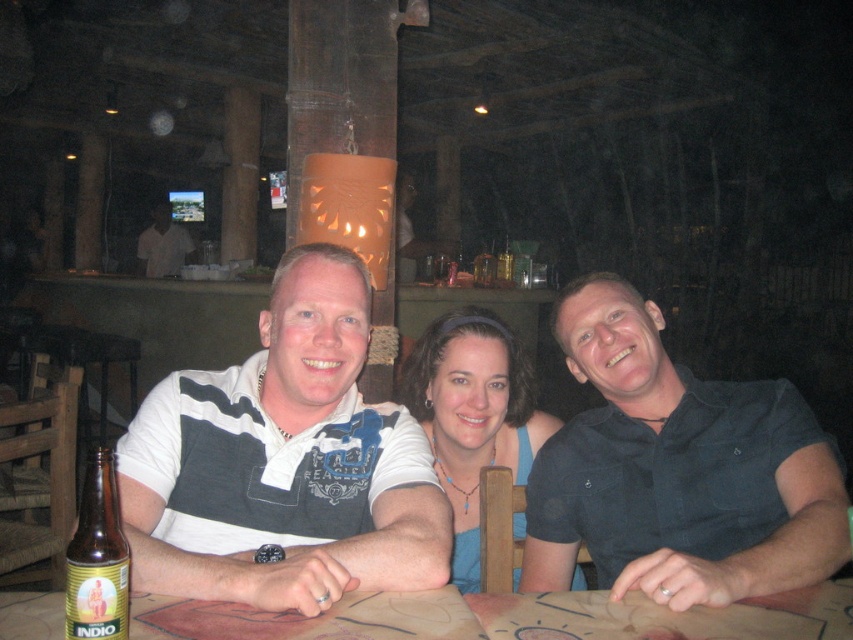
Based on the scene description, can you determine if the wooden table at center is wider than the white shirt at center?

The wooden table at center is wider than the white shirt at center according to the description.

You are a bartender preparing to serve drinks to the group. You have a tray with three glasses. The glasses are placed in a line from left to right as follows. The first glass is for the person wearing the dark blue shirt at center. The second glass is for the person wearing the blue fabric headband at center. The third glass is for the person on the right. To ensure you place the glasses correctly, can you determine the order of the people from left to right based on their clothing?

The dark blue shirt at center is positioned on the right side of the blue fabric headband at center. Therefore, the order from left to right should be blue fabric headband at center first, followed by dark blue shirt at center, and then the person on the right.